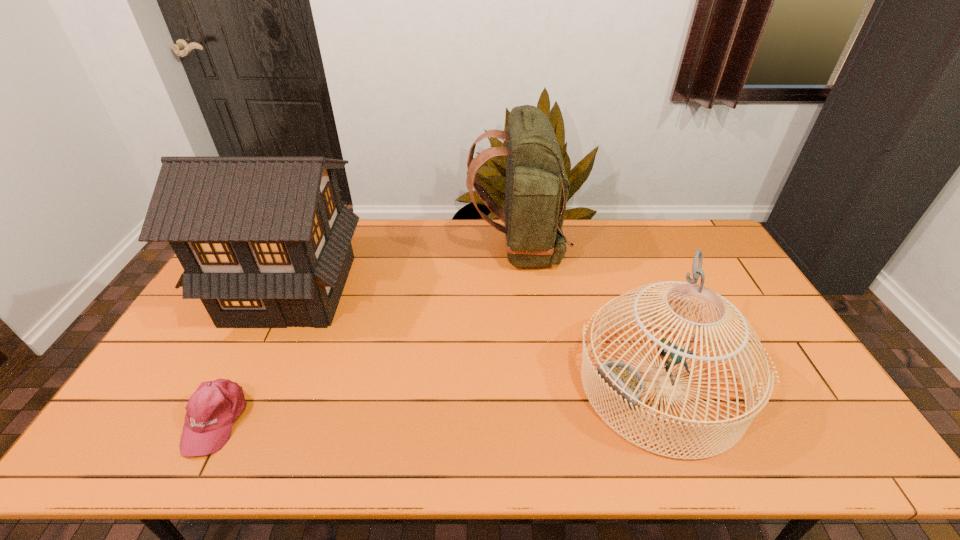
The width and height of the screenshot is (960, 540). Identify the location of dollhouse positioned at the far edge. (265, 242).

This screenshot has height=540, width=960. Find the location of `birdcage that is at the near edge`. birdcage that is at the near edge is located at coordinates (627, 382).

You are a GUI agent. You are given a task and a screenshot of the screen. Output one action in this format:
    pyautogui.click(x=<x>, y=<y>)
    Task: Click on the baseball cap that is at the near edge
    The width and height of the screenshot is (960, 540).
    Given the screenshot: What is the action you would take?
    pyautogui.click(x=215, y=405)

This screenshot has width=960, height=540. Identify the location of dollhouse at the left edge. (265, 242).

Identify the location of baseball cap that is at the left edge. (215, 405).

Where is `object present at the far left corner`? object present at the far left corner is located at coordinates pyautogui.click(x=265, y=242).

Where is `object that is at the near left corner`? object that is at the near left corner is located at coordinates (215, 405).

In order to click on vacant space at the far edge of the desktop in this screenshot , I will do `click(624, 237)`.

Image resolution: width=960 pixels, height=540 pixels. I want to click on free space at the near edge, so click(449, 447).

Where is `vacant space at the left edge of the desktop`? vacant space at the left edge of the desktop is located at coordinates pos(150,415).